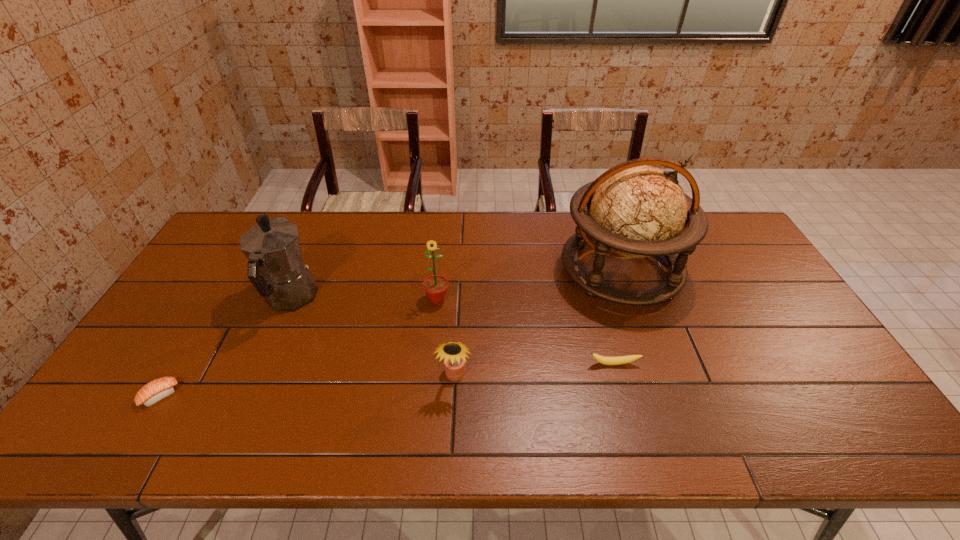
This screenshot has width=960, height=540. I want to click on vacant space at the far edge of the desktop, so click(x=564, y=236).

In the image, there is a desktop. Identify the location of free space at the near edge. Image resolution: width=960 pixels, height=540 pixels. (346, 422).

At what (x,y) coordinates should I click in order to perform the action: click on vacant space at the right edge of the desktop. Please return your answer as a coordinate pair (x, y). Looking at the image, I should click on (798, 335).

In the image, there is a desktop. Identify the location of vacant area at the near left corner. This screenshot has height=540, width=960. [x=94, y=418].

Find the location of `free space at the far right corner`. free space at the far right corner is located at coordinates (728, 251).

Identify the location of free space that is in between the taller sunflower and the leftmost object. (299, 347).

Find the location of `free space between the globe and the shortest object`. free space between the globe and the shortest object is located at coordinates (391, 332).

Where is `vacant space that's between the nearer sunflower and the banana`? The height and width of the screenshot is (540, 960). vacant space that's between the nearer sunflower and the banana is located at coordinates (535, 370).

Find the location of a particular element. free space between the fifth tallest object and the second object from left to right is located at coordinates (452, 331).

I want to click on free space between the leftmost object and the banana, so 387,379.